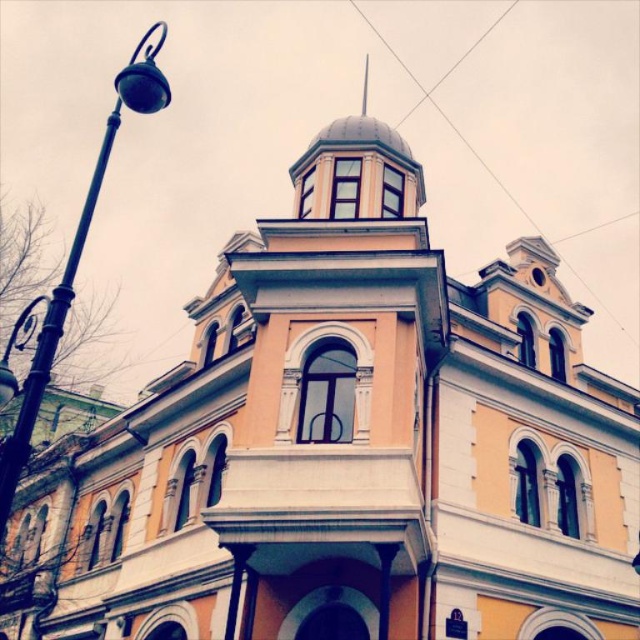
Between black metal lamp post at left and smooth white spire at upper center, which one is positioned higher?

smooth white spire at upper center is higher up.

Does black metal lamp post at left have a lesser height compared to smooth white spire at upper center?

Incorrect, black metal lamp post at left's height does not fall short of smooth white spire at upper center's.

Who is more distant from viewer, (38, 355) or (364, 64)?

Point (364, 64)

Locate an element on the screen. The width and height of the screenshot is (640, 640). black metal lamp post at left is located at coordinates (77, 259).